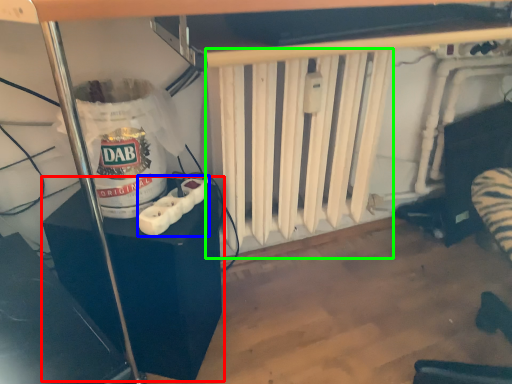
Question: Which is farther away from furniture (highlighted by a red box)? Wii controller (highlighted by a blue box) or radiator (highlighted by a green box)?

Choices:
 (A) Wii controller
 (B) radiator

Answer: (B)